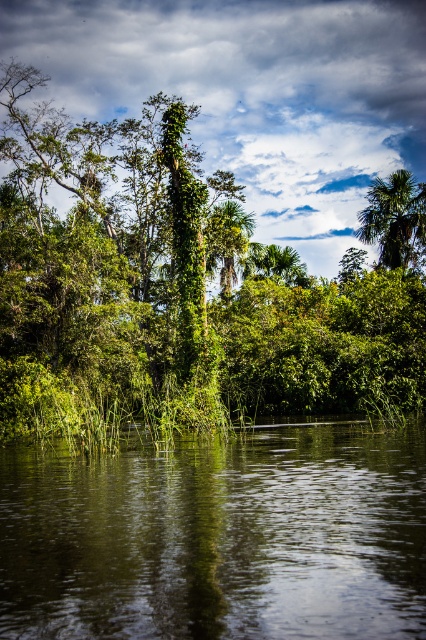
Question: Which object appears farthest from the camera in this image?

Choices:
 (A) green leafy tree at center
 (B) green leafy palm tree at upper right
 (C) green leafy palm tree at center

Answer: (B)

Question: Does green leafy tree at center appear on the left side of green leafy palm tree at center?

Choices:
 (A) yes
 (B) no

Answer: (B)

Question: Is green reflective water at center above green leafy palm tree at upper right?

Choices:
 (A) yes
 (B) no

Answer: (B)

Question: Considering the relative positions of green leafy tree at center and green reflective water at center in the image provided, where is green leafy tree at center located with respect to green reflective water at center?

Choices:
 (A) left
 (B) right

Answer: (B)

Question: Which of the following is the farthest from the observer?

Choices:
 (A) (252, 216)
 (B) (189, 472)
 (C) (48, 109)
 (D) (371, 196)

Answer: (A)

Question: Which is farther from the green leafy palm tree at upper right?

Choices:
 (A) green reflective water at center
 (B) green leafy palm tree at center

Answer: (A)